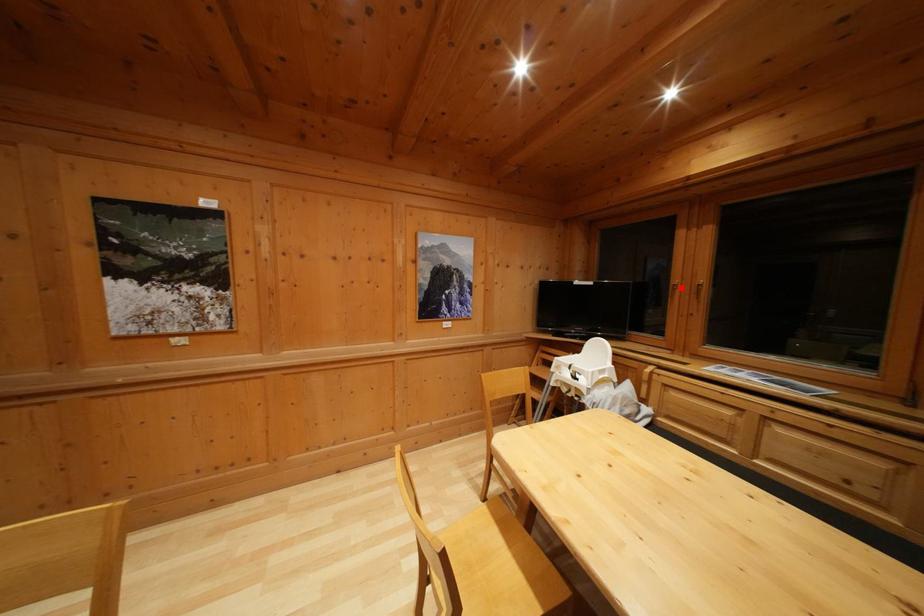
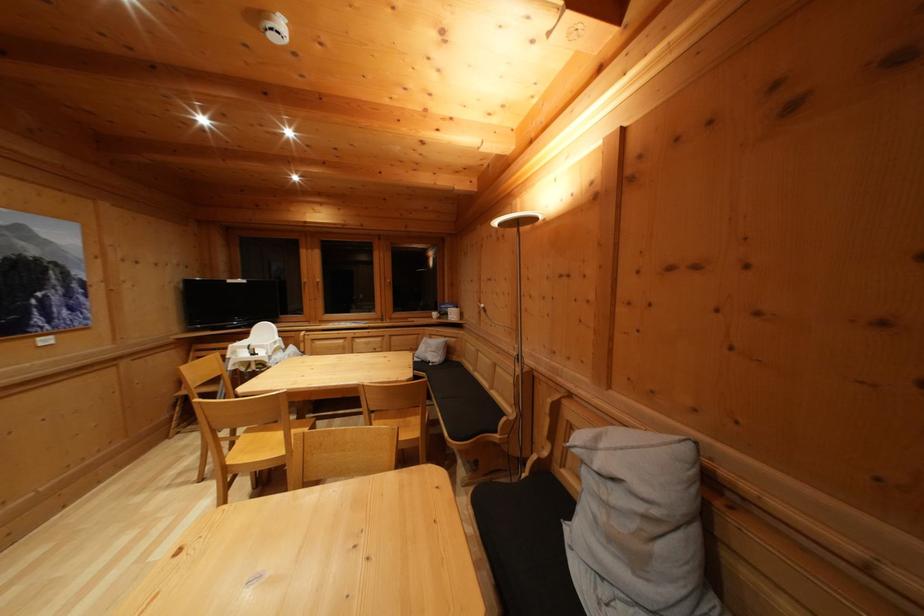
Question: I am providing you with two images of the same scene from different viewpoints. Image1 has a red point marked. In image2, the corresponding 3D location appears at what relative position? Reply with the corresponding letter.

Choices:
 (A) Closer
 (B) Farther

Answer: (A)